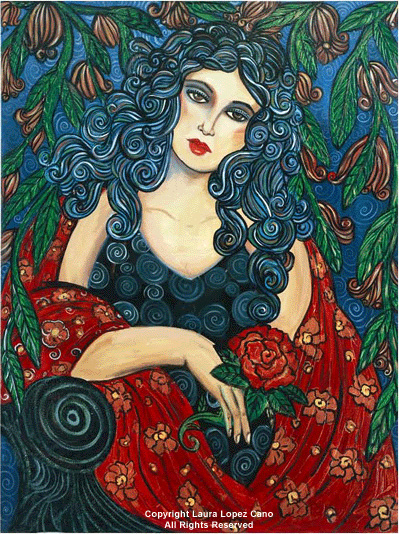
Identify the location of seat. The height and width of the screenshot is (534, 399). (68, 446).